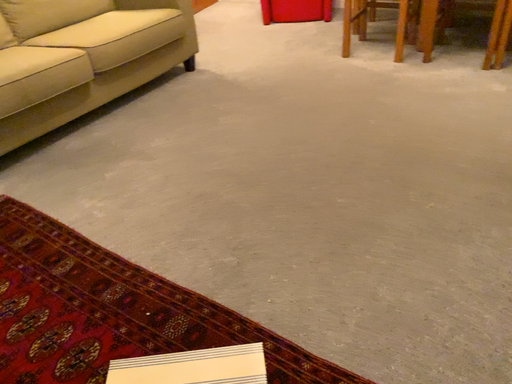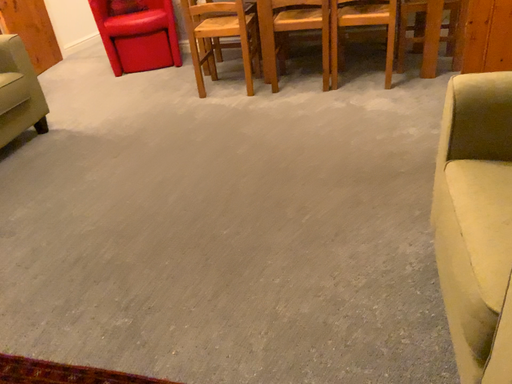
Question: How did the camera likely rotate when shooting the video?

Choices:
 (A) rotated left
 (B) rotated right

Answer: (B)